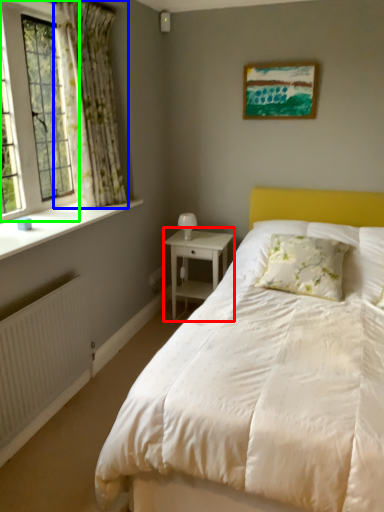
Question: Which object is the closest to the nightstand (highlighted by a red box)? Choose among these: curtain (highlighted by a blue box) or window (highlighted by a green box).

Choices:
 (A) curtain
 (B) window

Answer: (A)